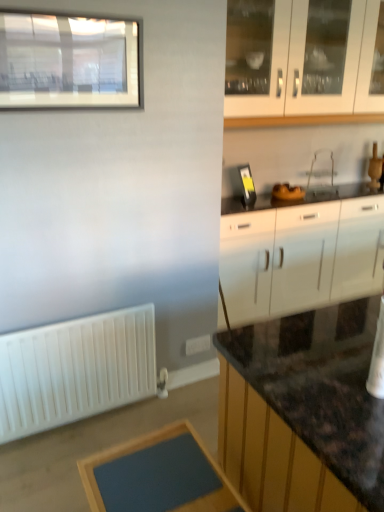
Question: Does point (243, 245) appear closer or farther from the camera than point (299, 196)?

Choices:
 (A) farther
 (B) closer

Answer: (B)

Question: Based on their positions, is white glossy cabinet at right, which appears as the second cabinetry when viewed from the top, located to the left or right of clear plastic sink at center?

Choices:
 (A) right
 (B) left

Answer: (A)

Question: Estimate the real-world distances between objects in this image. Which object is farther from the white plastic electric outlet at lower center?

Choices:
 (A) clear plastic sink at center
 (B) white glossy cabinet at right, the first cabinetry positioned from the bottom
 (C) blue matte table at lower center
 (D) white matte radiator at lower left
 (E) matte glass window at upper left

Answer: (E)

Question: Which is nearer to the matte glass window at upper left?

Choices:
 (A) clear plastic sink at center
 (B) white plastic electric outlet at lower center
 (C) white glossy cabinet at upper right, which ranks as the first cabinetry in top-to-bottom order
 (D) white matte radiator at lower left
 (E) blue matte table at lower center

Answer: (C)